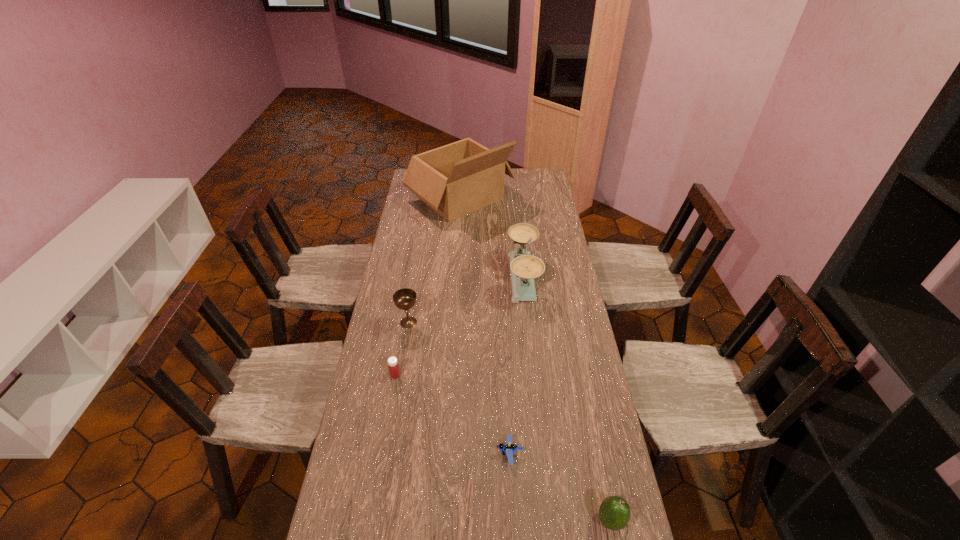
At what (x,y) coordinates should I click in order to perform the action: click on blank area at the right edge. Please return your answer as a coordinate pair (x, y). Looking at the image, I should click on (523, 192).

Identify the location of empty location between the chalice and the shortest object. (459, 388).

Locate an element on the screen. vacant point located between the fourth tallest object and the third farthest object is located at coordinates (510, 421).

Locate an element on the screen. The width and height of the screenshot is (960, 540). empty location between the fourth nearest object and the fifth farthest object is located at coordinates (459, 388).

Find the location of a particular element. empty space that is in between the third tallest object and the rightmost object is located at coordinates pos(510,421).

Find the location of `vacant point located between the tallest object and the scale`. vacant point located between the tallest object and the scale is located at coordinates (492, 238).

I want to click on free space between the scale and the nearest object, so point(566,399).

The image size is (960, 540). Find the location of `vacant space that is in between the box and the Lego`. vacant space that is in between the box and the Lego is located at coordinates (485, 326).

You are a GUI agent. You are given a task and a screenshot of the screen. Output one action in this format:
    pyautogui.click(x=<x>, y=<y>)
    Task: Click on the free spot between the third nearest object and the shortest object
    This screenshot has height=540, width=960.
    Given the screenshot: What is the action you would take?
    pyautogui.click(x=452, y=414)

Locate an element on the screen. free spot between the rightmost object and the fourth nearest object is located at coordinates (510, 421).